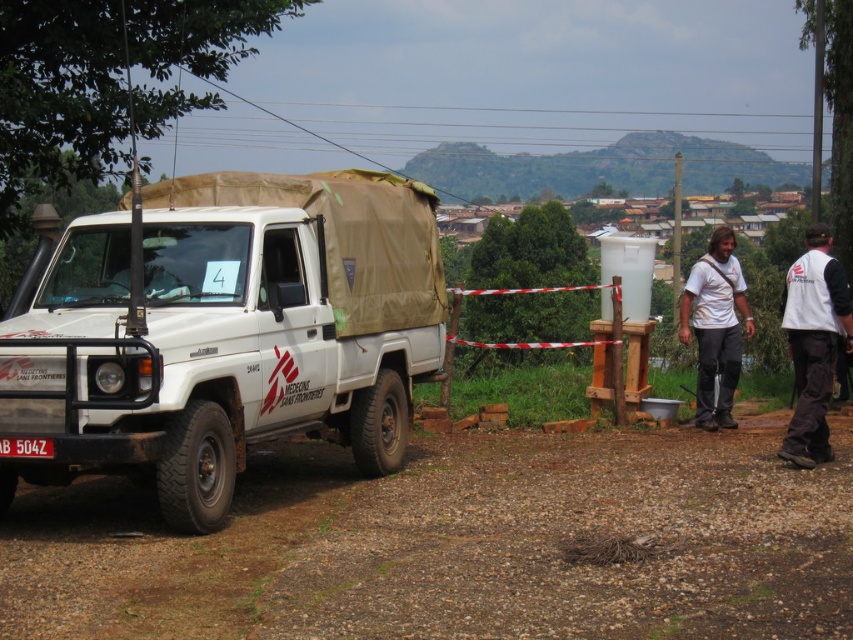
Is white fabric vest at right below white t-shirt at center?

Actually, white fabric vest at right is above white t-shirt at center.

Can you confirm if white fabric vest at right is taller than white t-shirt at center?

In fact, white fabric vest at right may be shorter than white t-shirt at center.

What do you see at coordinates (813, 342) in the screenshot? I see `white fabric vest at right` at bounding box center [813, 342].

Identify the location of white fabric vest at right. click(x=813, y=342).

Does brown gravel dirt at lower left have a larger size compared to white t-shirt at center?

No.

Looking at this image, does brown gravel dirt at lower left have a lesser width compared to white t-shirt at center?

No.

At what (x,y) coordinates should I click in order to perform the action: click on brown gravel dirt at lower left. Please return your answer as a coordinate pair (x, y). Looking at the image, I should click on (454, 545).

Does white matte truck at left appear on the right side of white t-shirt at center?

No, white matte truck at left is not to the right of white t-shirt at center.

Find the location of `white matte truck at left`. white matte truck at left is located at coordinates (225, 333).

Who is more distant from viewer, (18, 445) or (720, 285)?

The point (720, 285) is behind.

This screenshot has height=640, width=853. In order to click on white matte truck at left in this screenshot , I will do `click(225, 333)`.